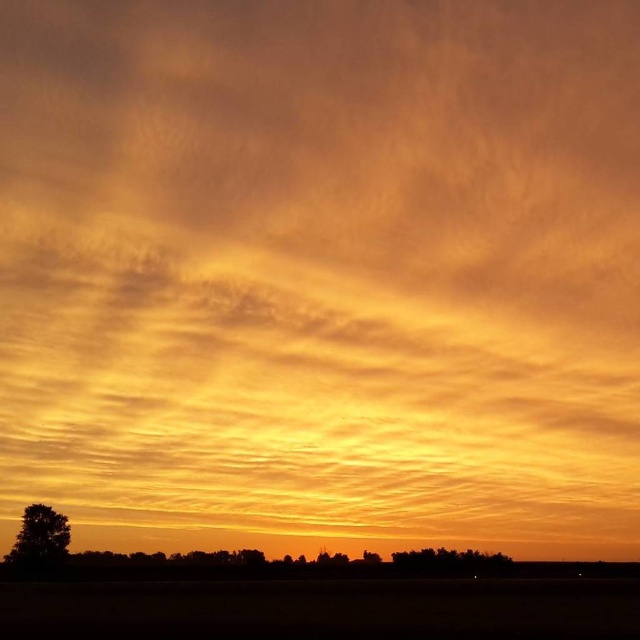
Question: Which point is farther to the camera?

Choices:
 (A) (52, 561)
 (B) (493, 556)

Answer: (B)

Question: Which point is closer to the camera taking this photo?

Choices:
 (A) (12, 563)
 (B) (445, 573)

Answer: (B)

Question: Can you confirm if silhouette tree at lower left is positioned to the right of silhouette tree at lower center?

Choices:
 (A) yes
 (B) no

Answer: (B)

Question: Is silhouette tree at lower left bigger than silhouette tree at lower center?

Choices:
 (A) yes
 (B) no

Answer: (B)

Question: Does silhouette tree at lower left come in front of silhouette tree at lower center?

Choices:
 (A) no
 (B) yes

Answer: (A)

Question: Which object appears farthest from the camera in this image?

Choices:
 (A) silhouette tree at lower left
 (B) silhouette tree at lower center

Answer: (A)